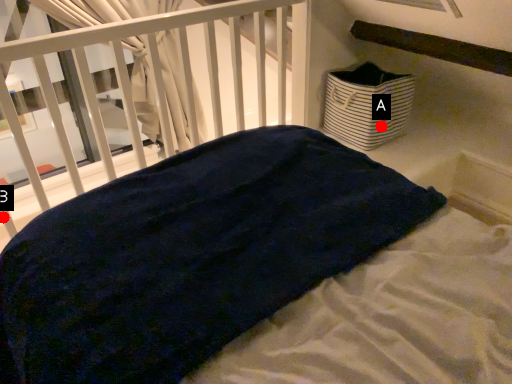
Question: Two points are circled on the image, labeled by A and B beside each circle. Among these points, which one is nearest to the camera?

Choices:
 (A) A is closer
 (B) B is closer

Answer: (A)